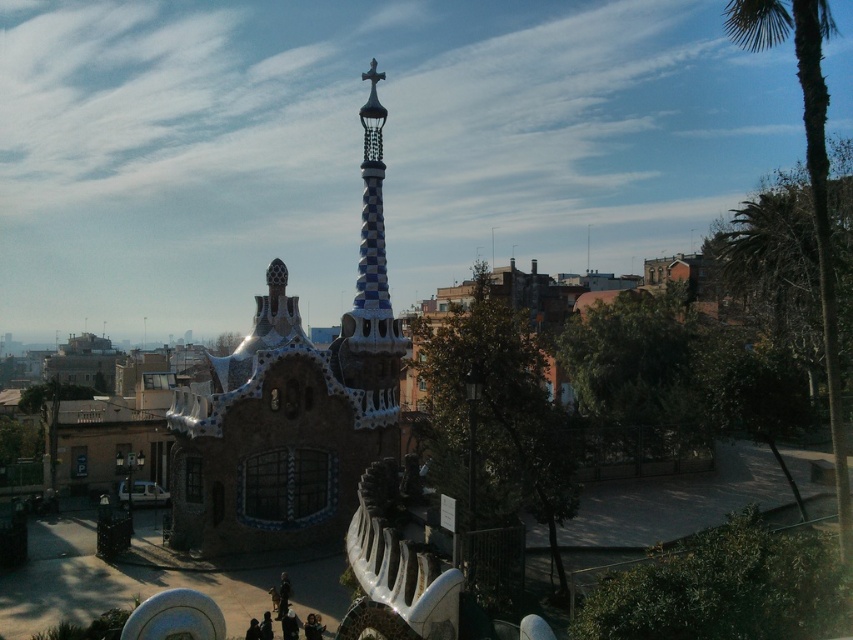
Is blue mosaic tower at center behind green leafy palm tree at right?

Yes.

Is blue mosaic tower at center bigger than green leafy palm tree at right?

Actually, blue mosaic tower at center might be smaller than green leafy palm tree at right.

Describe the element at coordinates (283, 426) in the screenshot. I see `blue mosaic tower at center` at that location.

I want to click on blue mosaic tower at center, so click(283, 426).

Does blue mosaic tower at center have a greater width compared to checkerboard ceramic spire at center?

Correct, the width of blue mosaic tower at center exceeds that of checkerboard ceramic spire at center.

Can you confirm if blue mosaic tower at center is positioned to the left of checkerboard ceramic spire at center?

Correct, you'll find blue mosaic tower at center to the left of checkerboard ceramic spire at center.

Between point (380, 403) and point (381, 241), which one is positioned in front?

Point (380, 403)

Identify the location of blue mosaic tower at center. (283, 426).

The image size is (853, 640). Describe the element at coordinates (808, 179) in the screenshot. I see `green leafy palm tree at right` at that location.

Is green leafy palm tree at right above checkerboard ceramic spire at center?

Yes, green leafy palm tree at right is above checkerboard ceramic spire at center.

Does point (834, 388) come farther from viewer compared to point (372, 356)?

No, (834, 388) is in front of (372, 356).

Locate an element on the screen. green leafy palm tree at right is located at coordinates (808, 179).